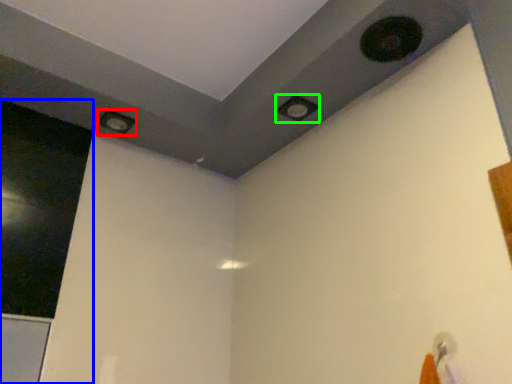
Question: Which object is the farthest from hole (highlighted by a red box)? Choose among these: screen door (highlighted by a blue box) or hole (highlighted by a green box).

Choices:
 (A) screen door
 (B) hole

Answer: (B)